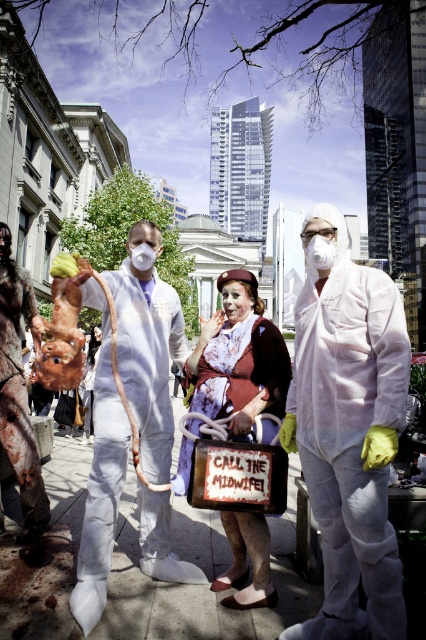
Question: Is white matte hazmat suit at center to the right of rusty metal pig at left from the viewer's perspective?

Choices:
 (A) no
 (B) yes

Answer: (B)

Question: Which point is farther from the camera taking this photo?

Choices:
 (A) (250, 372)
 (B) (23, 406)
 (C) (135, 292)

Answer: (C)

Question: Is matte brown dress at center wider than rusty metal pig at left?

Choices:
 (A) no
 (B) yes

Answer: (B)

Question: Estimate the real-world distances between objects in this image. Which object is farther from the rusty metal pig at left?

Choices:
 (A) matte brown dress at center
 (B) white matte/latex rubber prosthetic at center
 (C) white matte hazmat suit at center

Answer: (C)

Question: Which of the following is the farthest from the observer?

Choices:
 (A) rusty metal pig at left
 (B) white matte/latex rubber prosthetic at center
 (C) white matte hazmat suit at center

Answer: (A)

Question: Is white matte/latex rubber prosthetic at center positioned behind matte brown dress at center?

Choices:
 (A) no
 (B) yes

Answer: (A)